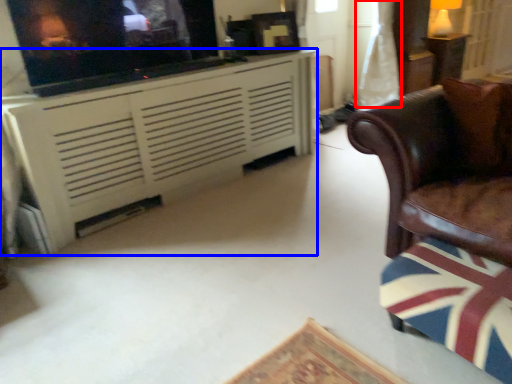
Question: Among these objects, which one is nearest to the camera, curtain (highlighted by a red box) or cabinetry (highlighted by a blue box)?

Choices:
 (A) curtain
 (B) cabinetry

Answer: (B)